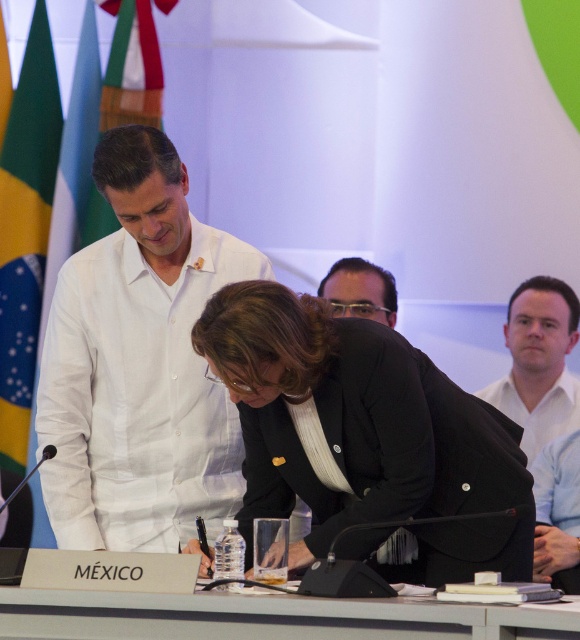
You are standing at the origin point of the coordinate system. You want to move towards the black matte blazer at center. What direction should you move in?

The black matte blazer at center is located at coordinate point 0.686 on the x axis and 0.628 on the y axis, so you should move northeast to reach it.

You are attending a formal signing ceremony and notice two features of the central figure. The black matte blazer at center and the brown hair at center. Which one is positioned higher on the person?

The brown hair at center is positioned higher because the black matte blazer at center is located below it.

In the scene of a diplomatic signing ceremony, there is a woman in a black blazer at center and a man in a black suit at upper right. The black matte blazer at center is represented by point (364, 438). Can you determine the spatial relationship between the black matte blazer at center and the man in a black suit at upper right based on their coordinates?

The black matte blazer at center is located at coordinates (364, 438). Since the man in a black suit at upper right is positioned higher and to the right compared to the blazer, the man is above and to the right of the black matte blazer at center.